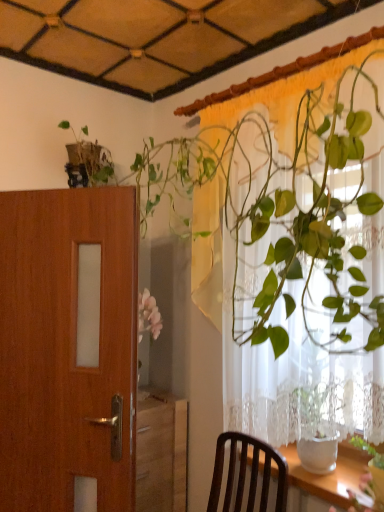
Question: Based on their positions, is green leafy plant at upper right located to the left or right of wooden door at left?

Choices:
 (A) right
 (B) left

Answer: (A)

Question: In terms of width, does green leafy plant at upper right look wider or thinner when compared to wooden door at left?

Choices:
 (A) wide
 (B) thin

Answer: (A)

Question: Considering the real-world distances, which object is farthest from the green leafy plant at upper right?

Choices:
 (A) green glossy plant at upper right
 (B) wooden door at left

Answer: (B)

Question: Considering the real-world distances, which object is farthest from the green leafy plant at upper right?

Choices:
 (A) green glossy plant at upper right
 (B) wooden door at left

Answer: (B)